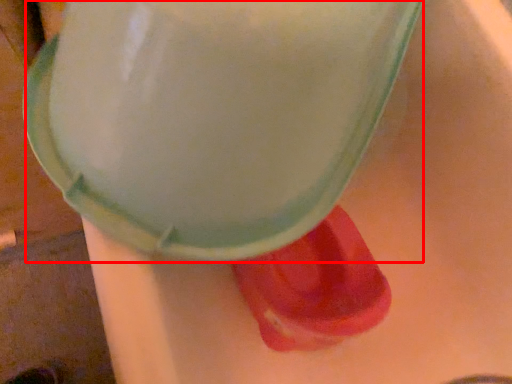
Question: Considering the relative positions of foam (annotated by the red box) and footwear in the image provided, where is foam (annotated by the red box) located with respect to the staircase?

Choices:
 (A) left
 (B) right

Answer: (A)